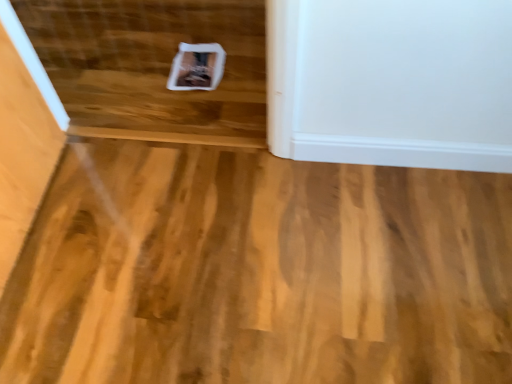
Question: From a real-world perspective, is natural wood floor at center above or below white paper at center?

Choices:
 (A) below
 (B) above

Answer: (A)

Question: Is natural wood floor at center to the left or to the right of white paper at center in the image?

Choices:
 (A) left
 (B) right

Answer: (B)

Question: From the image's perspective, relative to white paper at center, is natural wood floor at center above or below?

Choices:
 (A) above
 (B) below

Answer: (B)

Question: Is white paper at center in front of or behind natural wood floor at center in the image?

Choices:
 (A) behind
 (B) front

Answer: (A)

Question: Does point click(x=27, y=23) appear closer or farther from the camera than point click(x=434, y=228)?

Choices:
 (A) closer
 (B) farther

Answer: (B)

Question: Considering the positions of white paper at center and natural wood floor at center in the image, is white paper at center taller or shorter than natural wood floor at center?

Choices:
 (A) tall
 (B) short

Answer: (A)

Question: From a real-world perspective, is white paper at center above or below natural wood floor at center?

Choices:
 (A) below
 (B) above

Answer: (B)